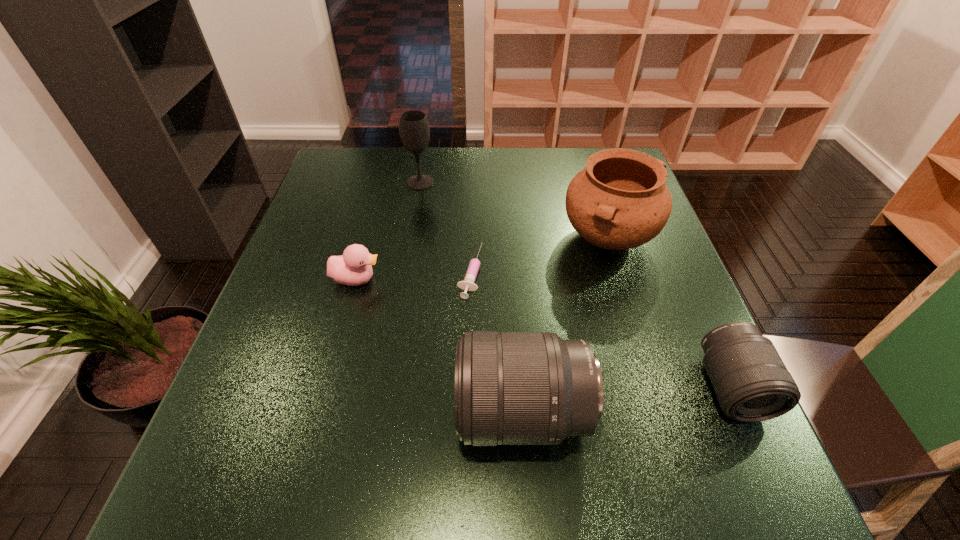
What are the coordinates of `vacant space at the far edge` in the screenshot? It's located at (459, 160).

Identify the location of vacant space at the near edge of the desktop. Image resolution: width=960 pixels, height=540 pixels. (440, 406).

In the image, there is a desktop. Where is `free space at the left edge`? The image size is (960, 540). free space at the left edge is located at coordinates click(344, 214).

Where is `vacant region at the far left corner of the desktop`? vacant region at the far left corner of the desktop is located at coordinates (370, 187).

At what (x,y) coordinates should I click in order to perform the action: click on vacant region between the syringe and the shorter telephoto lens. Please return your answer as a coordinate pair (x, y). The width and height of the screenshot is (960, 540). Looking at the image, I should click on (601, 329).

Locate an element on the screen. The height and width of the screenshot is (540, 960). free space between the shorter telephoto lens and the pottery is located at coordinates (670, 313).

At what (x,y) coordinates should I click in order to perform the action: click on empty space that is in between the pottery and the wineglass. Please return your answer as a coordinate pair (x, y). Image resolution: width=960 pixels, height=540 pixels. Looking at the image, I should click on (515, 211).

The height and width of the screenshot is (540, 960). I want to click on free area in between the farthest object and the shorter telephoto lens, so click(576, 285).

The image size is (960, 540). Identify the location of empty space that is in between the farthest object and the right telephoto lens. (576, 285).

Identify the location of free area in between the shorter telephoto lens and the pottery. Image resolution: width=960 pixels, height=540 pixels. (670, 313).